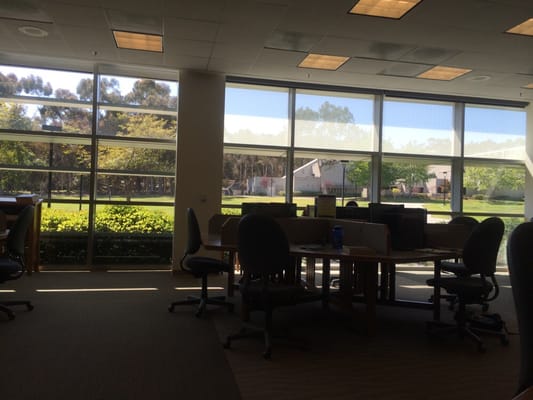
The height and width of the screenshot is (400, 533). I want to click on gray carpet, so click(169, 363).